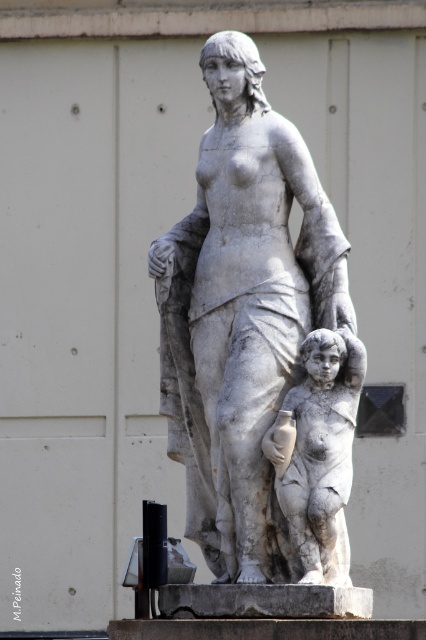
Who is higher up, white marble statue at center or white marble child at center?

white marble statue at center

Can you confirm if white marble statue at center is thinner than white marble child at center?

No, white marble statue at center is not thinner than white marble child at center.

Which is behind, point (164, 268) or point (290, 484)?

Point (164, 268)

The width and height of the screenshot is (426, 640). I want to click on white marble statue at center, so click(259, 340).